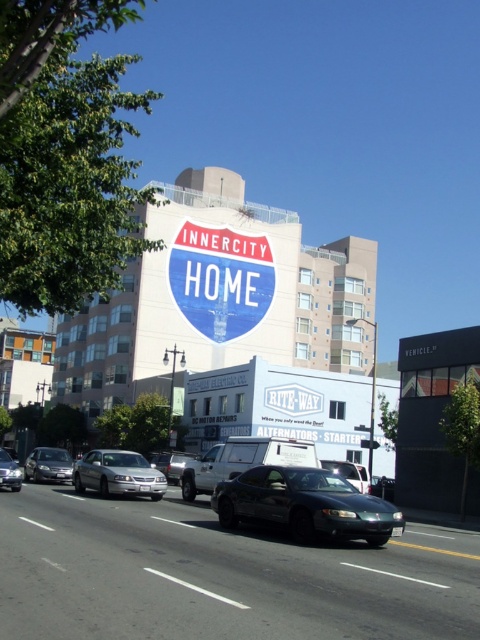
Question: Among these points, which one is nearest to the camera?

Choices:
 (A) (254, 515)
 (B) (109, 464)
 (C) (12, 460)
 (D) (45, 470)

Answer: (A)

Question: Among these objects, which one is nearest to the camera?

Choices:
 (A) satin silver sedan at center
 (B) metallic silver truck at center

Answer: (B)

Question: Does shiny dark green car at center appear under shiny silver sedan at lower left?

Choices:
 (A) yes
 (B) no

Answer: (B)

Question: Can you confirm if shiny dark green car at center is bigger than blue glossy sign at center?

Choices:
 (A) yes
 (B) no

Answer: (B)

Question: Does satin silver sedan at center come in front of shiny silver sedan at left?

Choices:
 (A) no
 (B) yes

Answer: (B)

Question: Among these objects, which one is farthest from the camera?

Choices:
 (A) blue glossy sign at center
 (B) shiny silver sedan at lower left

Answer: (A)